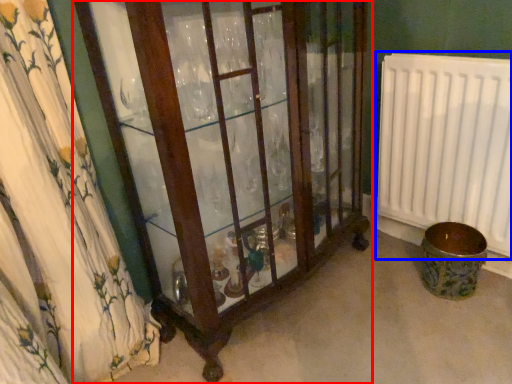
Question: Which object is further to the camera taking this photo, furniture (highlighted by a red box) or radiator (highlighted by a blue box)?

Choices:
 (A) furniture
 (B) radiator

Answer: (B)